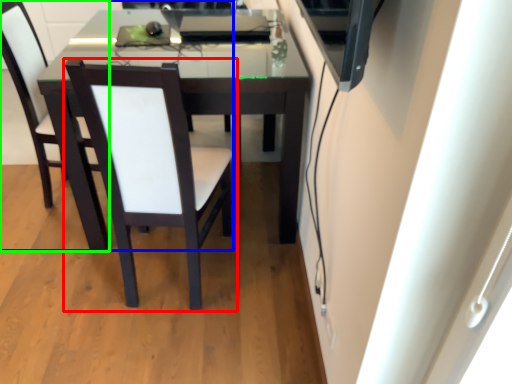
Question: Which is nearer to the chair (highlighted by a red box)? chair (highlighted by a blue box) or chair (highlighted by a green box).

Choices:
 (A) chair
 (B) chair

Answer: (A)